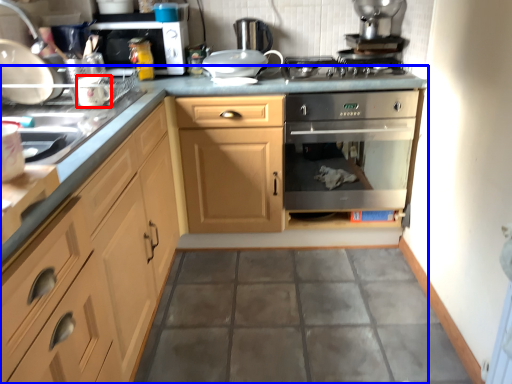
Question: Which object appears closest to the camera in this image, appliance (highlighted by a red box) or countertop (highlighted by a blue box)?

Choices:
 (A) appliance
 (B) countertop

Answer: (B)